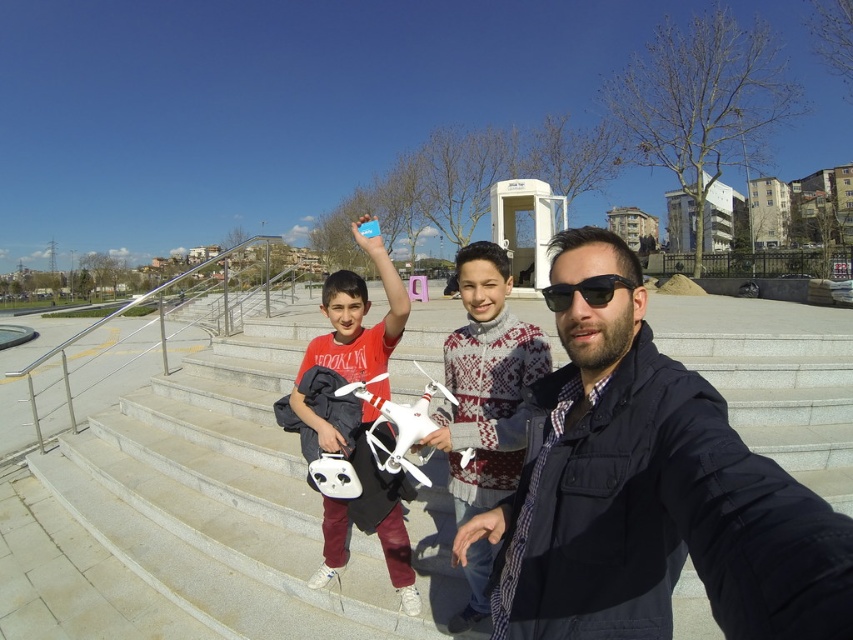
Question: Which point is closer to the camera taking this photo?

Choices:
 (A) (397, 561)
 (B) (579, 285)

Answer: (B)

Question: Which of the following is the farthest from the observer?

Choices:
 (A) (556, 456)
 (B) (456, 416)
 (C) (397, 554)
 (D) (561, 296)

Answer: (C)

Question: In this image, where is dark blue jacket at center located relative to black plastic sunglasses at center?

Choices:
 (A) above
 (B) below

Answer: (B)

Question: Is white concrete stairs at center closer to camera compared to white matte drone at center?

Choices:
 (A) yes
 (B) no

Answer: (B)

Question: Based on their relative distances, which object is farther from the dark blue jacket at center?

Choices:
 (A) black plastic sunglasses at center
 (B) white concrete stairs at center

Answer: (B)

Question: Can you confirm if dark blue jacket at center is bigger than black plastic sunglasses at center?

Choices:
 (A) yes
 (B) no

Answer: (A)